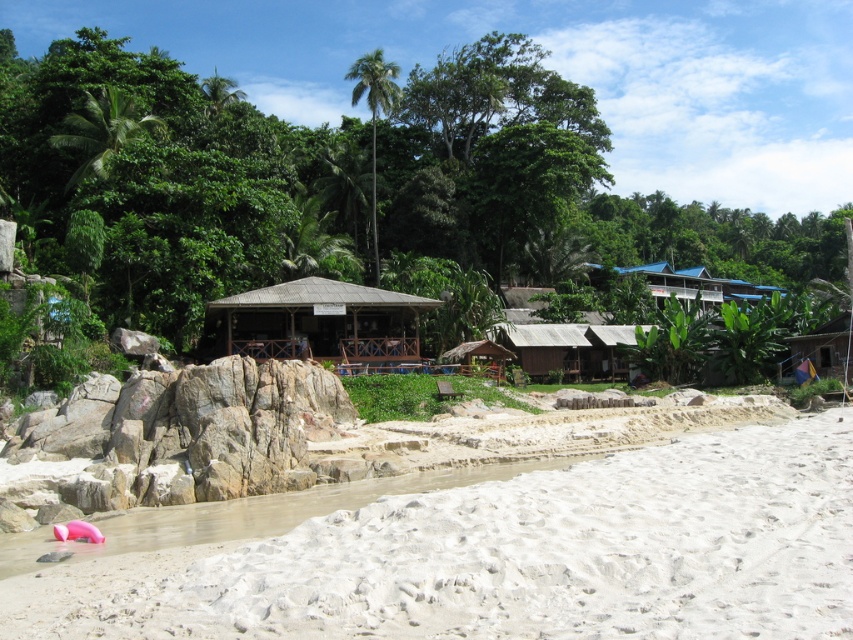
You are standing at the beach and see two points marked in the image. Which point, point (x=321, y=349) or point (x=802, y=344), is closer to you?

Point (x=321, y=349) is closer to the viewer than point (x=802, y=344).